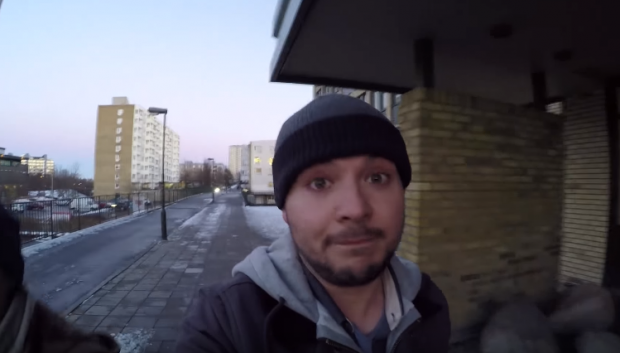
Image resolution: width=620 pixels, height=353 pixels. In order to click on hood in this screenshot , I will do `click(264, 251)`.